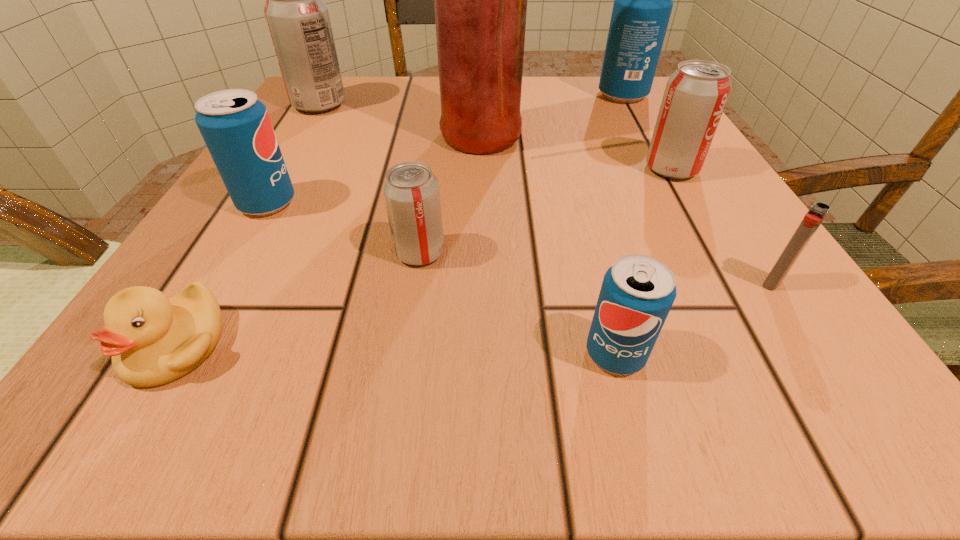
At what (x,y) coordinates should I click in order to perform the action: click on vacant space that satisfies the following two spatial constraints: 1. on the front side of the fifth farthest soda can; 2. on the right side of the third soda can from right to left. Please return your answer as a coordinate pair (x, y). Image resolution: width=960 pixels, height=540 pixels. Looking at the image, I should click on (405, 354).